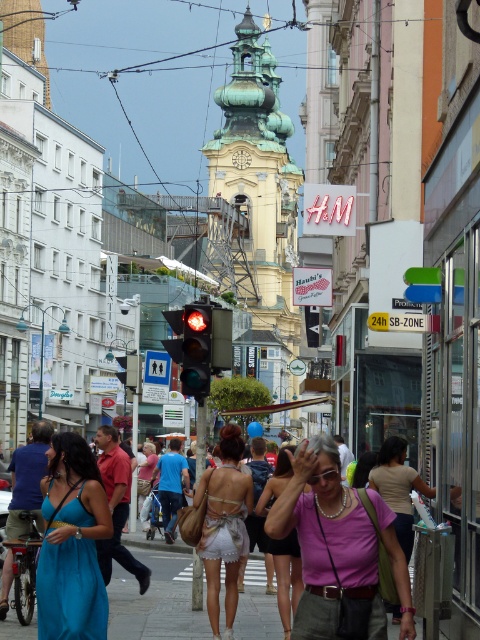
Does matte glass traffic light at center appear over pink fabric dress at center?

Indeed, matte glass traffic light at center is positioned over pink fabric dress at center.

Between matte glass traffic light at center and pink fabric dress at center, which one appears on the left side from the viewer's perspective?

matte glass traffic light at center

Between point (206, 380) and point (338, 436), which one is positioned behind?

Positioned behind is point (338, 436).

Locate an element on the screen. matte glass traffic light at center is located at coordinates (200, 342).

Does light beige fabric dress at center appear under matte white dress at center?

Correct, light beige fabric dress at center is located below matte white dress at center.

Describe the element at coordinates (224, 525) in the screenshot. Image resolution: width=480 pixels, height=640 pixels. I see `light beige fabric dress at center` at that location.

Find the location of a particular element. This screenshot has width=480, height=640. light beige fabric dress at center is located at coordinates (224, 525).

Find the location of `light beige fabric dress at center`. light beige fabric dress at center is located at coordinates (224, 525).

Does light beige fabric dress at center have a larger size compared to blue satin dress at lower left?

Correct, light beige fabric dress at center is larger in size than blue satin dress at lower left.

Which is more to the left, light beige fabric dress at center or blue satin dress at lower left?

From the viewer's perspective, blue satin dress at lower left appears more on the left side.

Is point (213, 499) closer to viewer compared to point (8, 516)?

Yes, it is in front of point (8, 516).

At what (x,y) coordinates should I click in order to perform the action: click on light beige fabric dress at center. Please return your answer as a coordinate pair (x, y). The image size is (480, 640). Looking at the image, I should click on (224, 525).